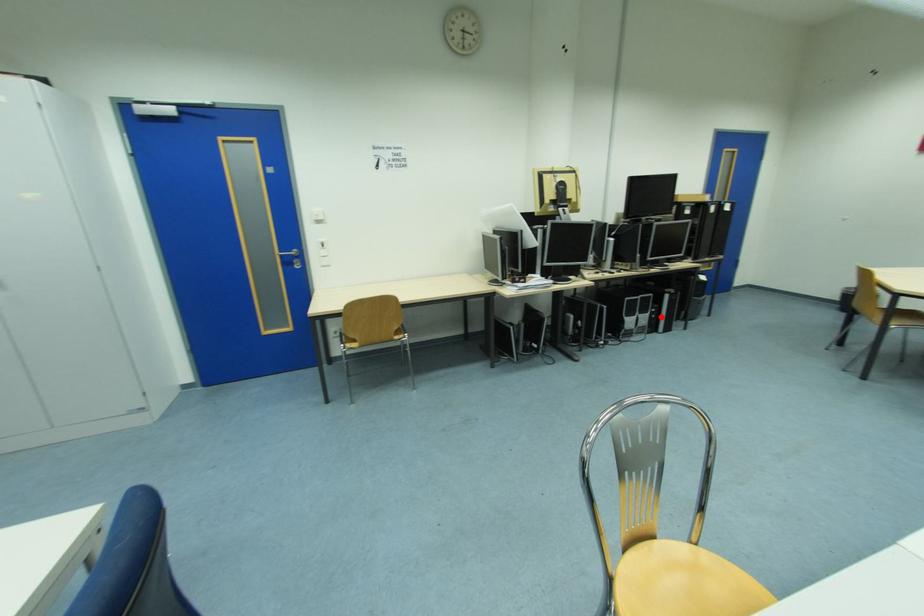
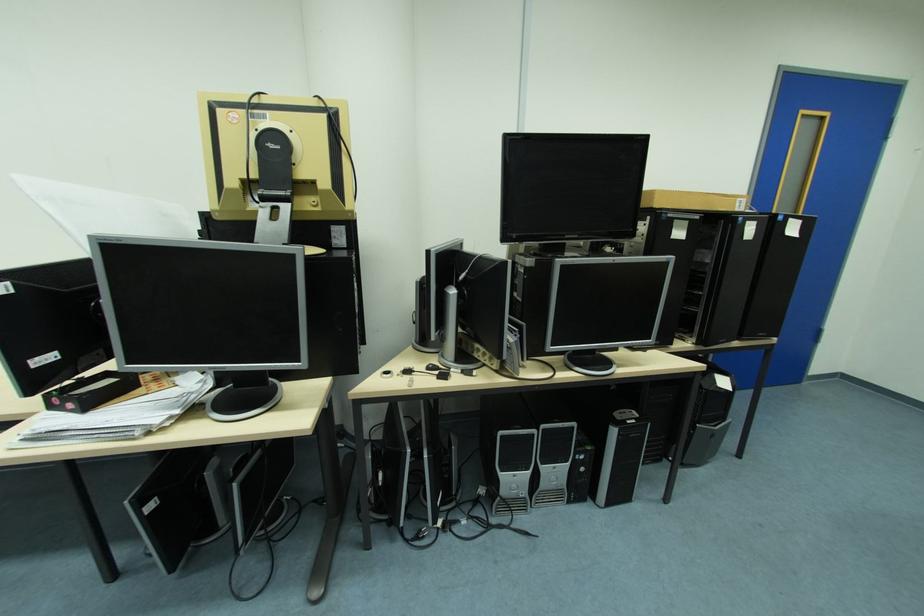
Find the pixel in the second image that matches the highlighted location in the first image.

(590, 469)